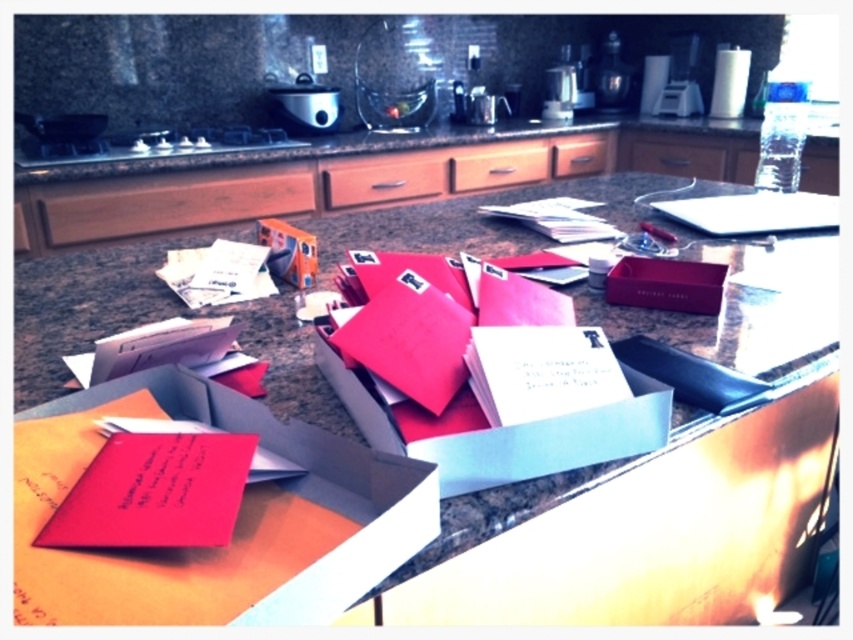
Question: Which of the following is the closest to the observer?

Choices:
 (A) (505, 426)
 (B) (611, 566)

Answer: (A)

Question: Which object is farther from the camera taking this photo?

Choices:
 (A) matte paper box at center
 (B) matte paper envelope at center

Answer: (B)

Question: Does matte paper envelope at center have a smaller size compared to matte paper box at center?

Choices:
 (A) no
 (B) yes

Answer: (A)

Question: Is matte paper envelope at center positioned before matte cardboard box at center?

Choices:
 (A) no
 (B) yes

Answer: (B)

Question: Which point is farther to the camera?

Choices:
 (A) matte cardboard box at center
 (B) matte paper box at center
 (C) matte paper envelope at center

Answer: (A)

Question: Is the position of matte paper envelope at center less distant than that of matte paper box at center?

Choices:
 (A) no
 (B) yes

Answer: (A)